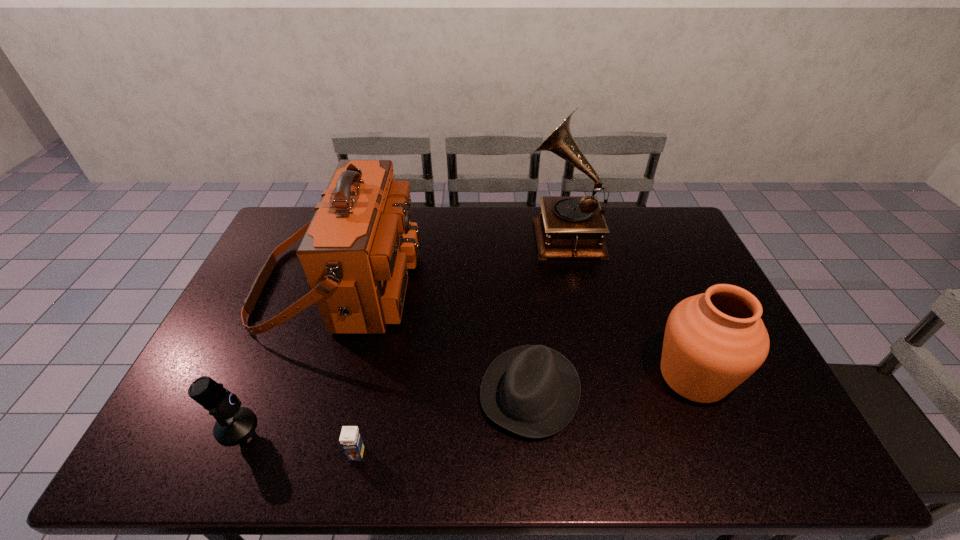
Image resolution: width=960 pixels, height=540 pixels. In order to click on record player in this screenshot , I will do `click(569, 226)`.

The height and width of the screenshot is (540, 960). Identify the location of satchel. (356, 251).

Locate an element on the screen. the fourth shortest object is located at coordinates (714, 341).

Where is `urn`? urn is located at coordinates point(714,341).

The height and width of the screenshot is (540, 960). I want to click on the fourth tallest object, so click(x=233, y=423).

Locate an element on the screen. The height and width of the screenshot is (540, 960). fedora is located at coordinates pyautogui.click(x=533, y=391).

You are a GUI agent. You are given a task and a screenshot of the screen. Output one action in this format:
    pyautogui.click(x=<x>, y=<y>)
    Task: Click on the nearest object
    The image size is (960, 540).
    Given the screenshot: What is the action you would take?
    pyautogui.click(x=351, y=441)

What are the coordinates of `vacant region located 0.290m on the horn of the record player` in the screenshot? It's located at (444, 233).

Locate an element on the screen. This screenshot has height=540, width=960. vacant region located 0.050m on the horn of the record player is located at coordinates (509, 233).

You are a GUI agent. You are given a task and a screenshot of the screen. Output one action in this format:
    pyautogui.click(x=<x>, y=<y>)
    Task: Click on the free point located on the horn of the record player
    The width and height of the screenshot is (960, 540).
    Given the screenshot: What is the action you would take?
    pyautogui.click(x=458, y=233)